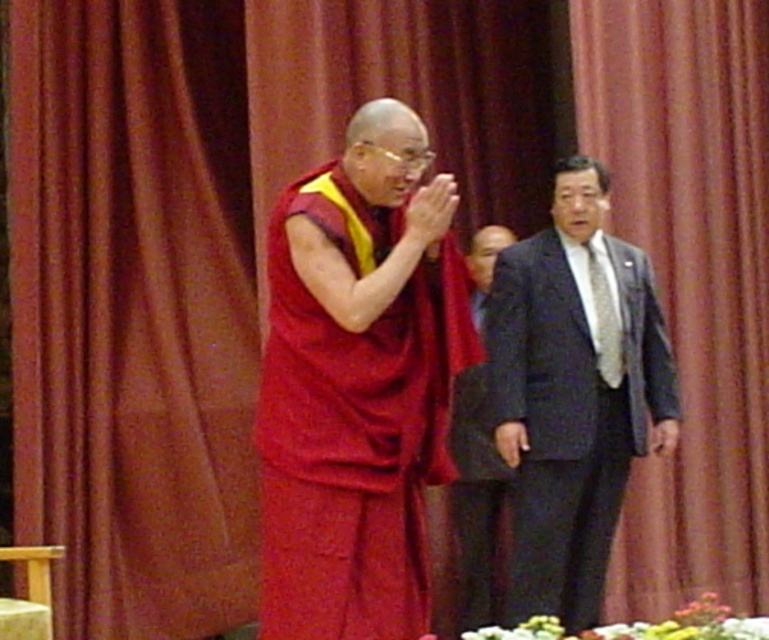
Can you confirm if matte red robe at center is positioned to the left of dark gray suit at right?

Correct, you'll find matte red robe at center to the left of dark gray suit at right.

Which of these two, matte red robe at center or dark gray suit at right, stands taller?

Standing taller between the two is dark gray suit at right.

I want to click on matte red robe at center, so click(358, 384).

Does dark gray suit at right come in front of dark gray suit at center?

Yes, it is in front of dark gray suit at center.

Can you confirm if dark gray suit at right is taller than dark gray suit at center?

Correct, dark gray suit at right is much taller as dark gray suit at center.

Identify the location of dark gray suit at right. (573, 394).

What do you see at coordinates (358, 384) in the screenshot? The width and height of the screenshot is (769, 640). I see `matte red robe at center` at bounding box center [358, 384].

Is matte red robe at center shorter than dark gray suit at center?

Incorrect, matte red robe at center's height does not fall short of dark gray suit at center's.

Locate an element on the screen. matte red robe at center is located at coordinates click(358, 384).

Find the location of a particular element. matte red robe at center is located at coordinates (358, 384).